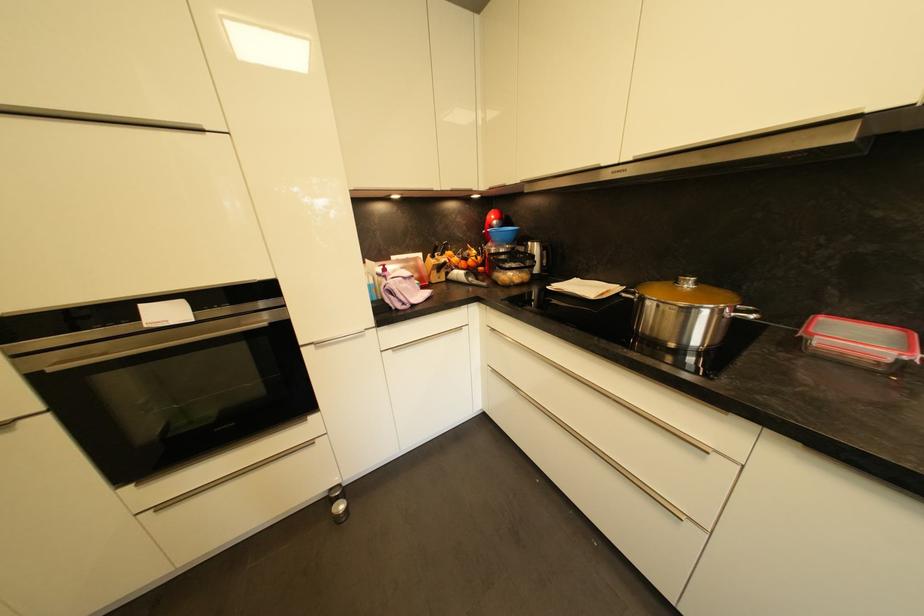
Which object does [462,257] point to?

It refers to a orange fruit.